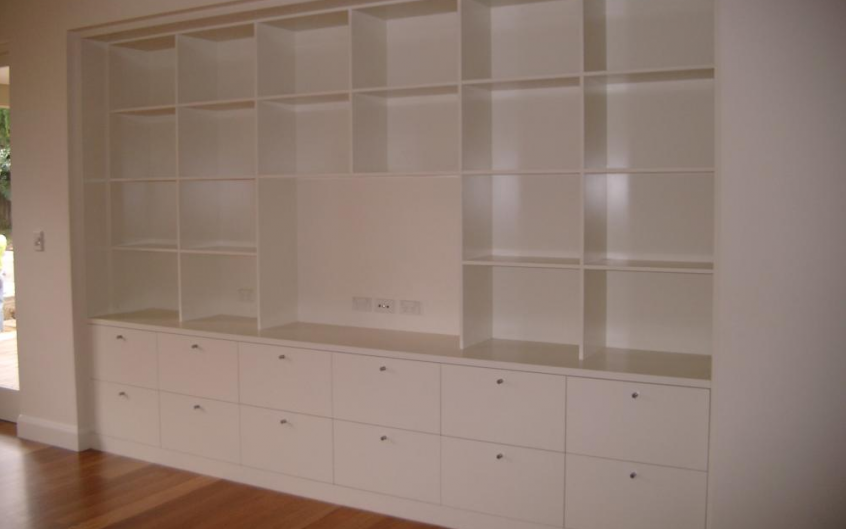
Image resolution: width=846 pixels, height=529 pixels. I want to click on doorway, so click(x=8, y=355).